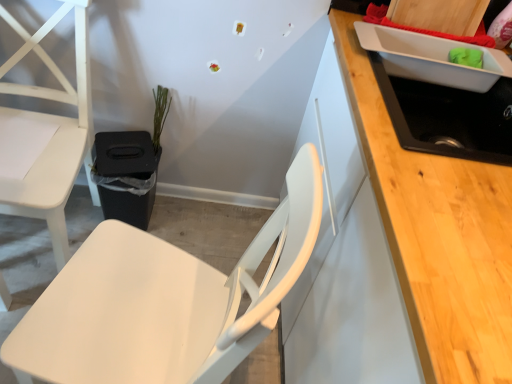
Question: Is black matte sink at upper right located outside green matte plant at center?

Choices:
 (A) yes
 (B) no

Answer: (A)

Question: Can you confirm if black matte sink at upper right is taller than green matte plant at center?

Choices:
 (A) yes
 (B) no

Answer: (B)

Question: Is green matte plant at center a part of black matte sink at upper right?

Choices:
 (A) yes
 (B) no

Answer: (B)

Question: Is green matte plant at center at the back of black matte sink at upper right?

Choices:
 (A) no
 (B) yes

Answer: (A)

Question: From a real-world perspective, is black matte sink at upper right over green matte plant at center?

Choices:
 (A) yes
 (B) no

Answer: (A)

Question: Considering the relative sizes of black matte sink at upper right and green matte plant at center in the image provided, is black matte sink at upper right thinner than green matte plant at center?

Choices:
 (A) yes
 (B) no

Answer: (B)

Question: Is the depth of green matte plant at center greater than that of matte white chair at center, which is counted as the 1th chair, starting from the right?

Choices:
 (A) no
 (B) yes

Answer: (B)

Question: From a real-world perspective, is green matte plant at center positioned under matte white chair at center, which is counted as the 1th chair, starting from the right, based on gravity?

Choices:
 (A) yes
 (B) no

Answer: (A)

Question: Can you confirm if green matte plant at center is thinner than matte white chair at center, acting as the 2th chair starting from the left?

Choices:
 (A) yes
 (B) no

Answer: (A)

Question: Does green matte plant at center appear on the left side of matte white chair at center, acting as the 2th chair starting from the left?

Choices:
 (A) no
 (B) yes

Answer: (B)

Question: Considering the relative sizes of green matte plant at center and matte white chair at center, acting as the 2th chair starting from the left, in the image provided, is green matte plant at center smaller than matte white chair at center, acting as the 2th chair starting from the left,?

Choices:
 (A) yes
 (B) no

Answer: (A)

Question: Does green matte plant at center lie in front of matte white chair at center, which is counted as the 1th chair, starting from the right?

Choices:
 (A) yes
 (B) no

Answer: (B)

Question: Is the position of green matte plant at center less distant than that of black matte sink at upper right?

Choices:
 (A) no
 (B) yes

Answer: (A)